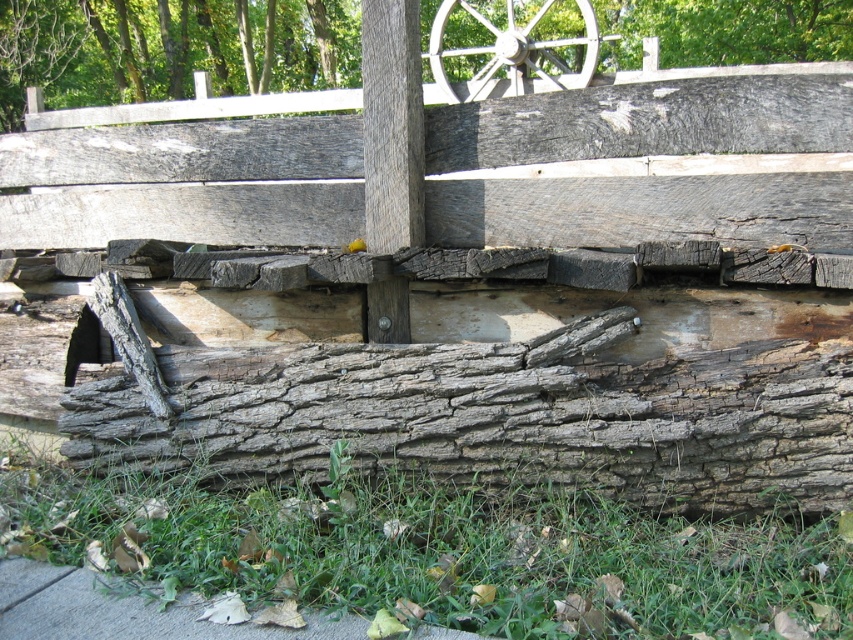
You are an architect inspecting a historical wooden structure. You notice two key components in the scene described. The first is the weathered brown wood at lower center, and the second is the white wooden wheel at upper center. Based on their sizes, which component might require more reinforcement to maintain structural stability?

The white wooden wheel at upper center requires more reinforcement because it is larger than the weathered brown wood at lower center.

You are a carpenter assessing the structural stability of the wooden structure. You notice the weathered brown wood at lower center and the smooth gray wood at upper center. Which part of the structure is taller?

The weathered brown wood at lower center is taller than the smooth gray wood at upper center according to the description.

You are standing at the base of this rustic wooden structure and need to place a 30 feet long wooden beam between the green rough grass at lower center and the smooth gray wood at upper center. Can you fit the beam between them without bending it?

The distance between the green rough grass at lower center and the smooth gray wood at upper center is 27.79 feet, which is shorter than the 30 feet beam. Therefore, the beam cannot be placed straight between them without bending.